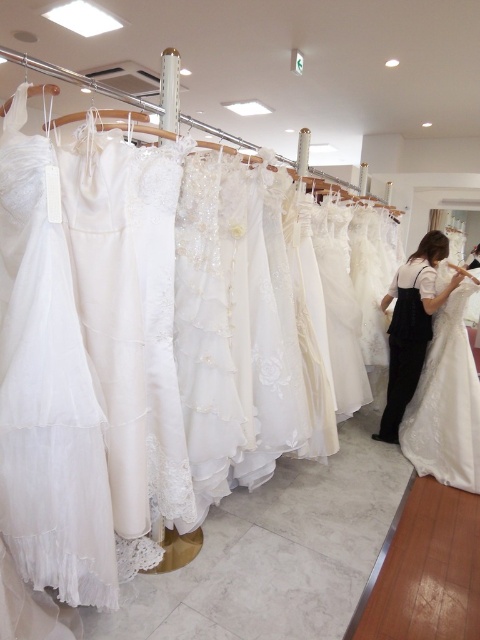
Can you confirm if satin white gown at right is thinner than white satin dress at center?

Yes.

Is point (417, 456) positioned after point (397, 387)?

No, it is not.

Is point (462, 358) behind point (411, 333)?

That is False.

Find the location of `satin white gown at right`. satin white gown at right is located at coordinates (445, 401).